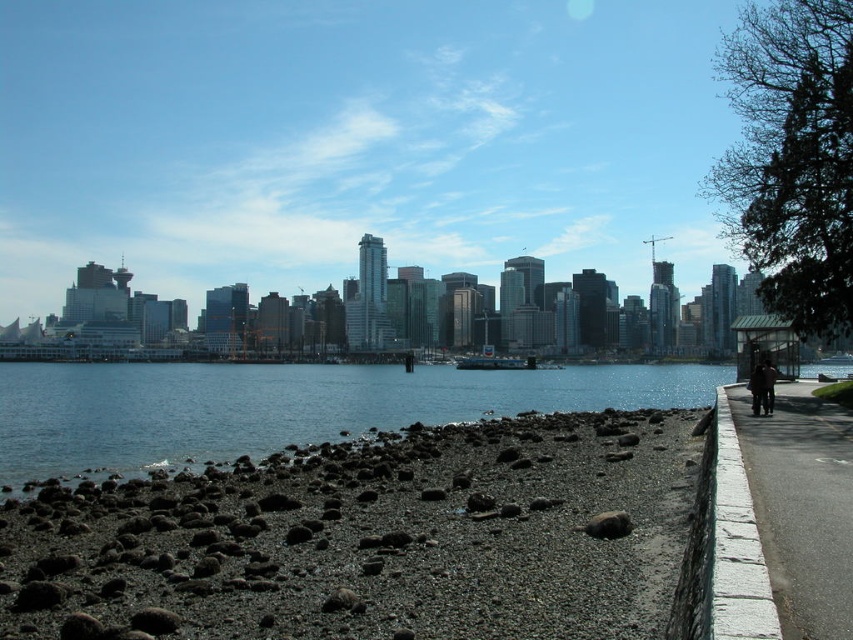
You are standing at the shoreline looking towards the city skyline. There are two points marked in the image. One is at coordinate point [25,456] and the other is at point [836,525]. Which point is closer to your current position?

Point [25,456] is closer to your current position because it is further to the camera than point [836,525].

You are a photographer planning to capture the waterfront scene. You want to ensure that the dark gray gravel at lower left and the clear blue water at lower left are both visible in your shot. Given their spatial relationship, which element will occupy a larger portion of the photograph?

The clear blue water at lower left occupies a larger portion of the photograph because it takes up more space than the dark gray gravel at lower left.

You are standing at the origin point of the image coordinate system, which is the bottom left corner. You want to walk to the dark gray gravel at lower left. Which direction should you move?

Since the dark gray gravel at lower left is at point 0.842 on the x axis and 0.435 on the y axis, you should move to the right along the x axis and slightly upwards along the y axis from the origin point to reach it.